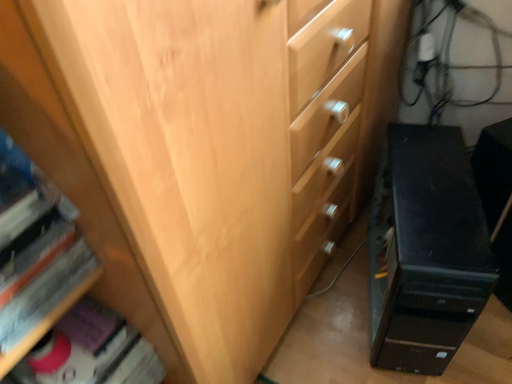
Question: Which is correct: matte pink book at lower left, which is the second book from top to bottom, is inside black plastic computer tower at lower right, or outside of it?

Choices:
 (A) outside
 (B) inside

Answer: (A)

Question: Relative to black plastic computer tower at lower right, is matte pink book at lower left, the 1th book when ordered from back to front, in front or behind?

Choices:
 (A) behind
 (B) front

Answer: (B)

Question: Estimate the real-world distances between objects in this image. Which object is closer to the hardcover book at lower left, which appears as the 1th book when viewed from the front?

Choices:
 (A) matte pink book at lower left, the 1th book when ordered from back to front
 (B) black plastic computer tower at lower right

Answer: (A)

Question: Which object is the farthest from the black plastic computer tower at lower right?

Choices:
 (A) hardcover book at lower left, which is the second book from bottom to top
 (B) matte pink book at lower left, which is the second book from top to bottom

Answer: (A)